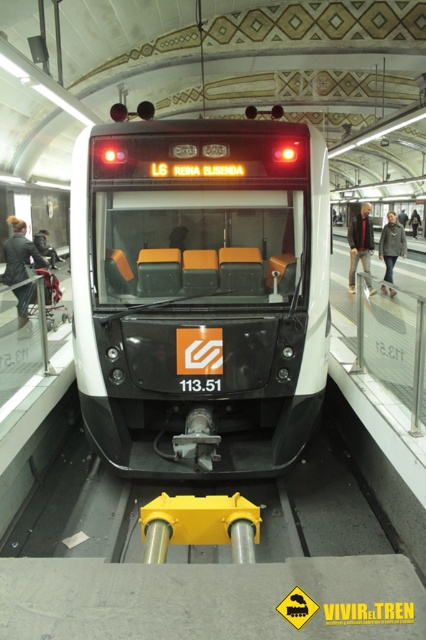
Question: From the image, what is the correct spatial relationship of gray woolen coat at center in relation to matte black jacket at center?

Choices:
 (A) below
 (B) above

Answer: (A)

Question: Is leather jacket at left wider than dark brown leather jacket at center?

Choices:
 (A) yes
 (B) no

Answer: (B)

Question: Can you confirm if white glossy train at center is positioned to the right of dark brown leather jacket at center?

Choices:
 (A) yes
 (B) no

Answer: (B)

Question: Estimate the real-world distances between objects in this image. Which object is farther from the leather jacket at left?

Choices:
 (A) dark brown leather jacket at center
 (B) matte black jacket at center

Answer: (A)

Question: Which point is closer to the camera taking this photo?

Choices:
 (A) (391, 291)
 (B) (14, 241)

Answer: (A)

Question: Which point appears closest to the camera in this image?

Choices:
 (A) (253, 260)
 (B) (402, 237)
 (C) (419, 218)
 (D) (37, 246)

Answer: (A)